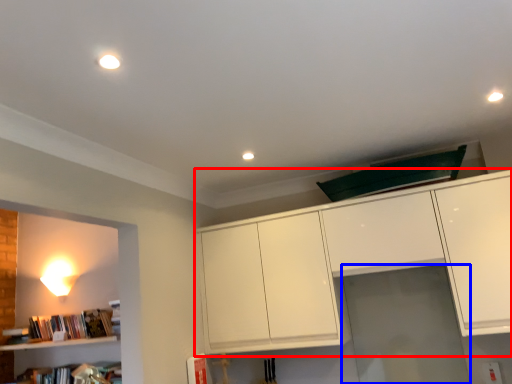
Question: Which point is closer to the camera, cabinetry (highlighted by a red box) or glass door (highlighted by a blue box)?

Choices:
 (A) cabinetry
 (B) glass door

Answer: (A)